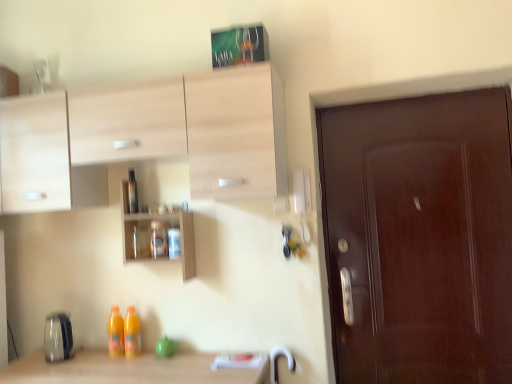
Question: From a real-world perspective, is wooden shelves at center physically located above or below transparent plastic bottle at center, the second bottle ordered from the bottom?

Choices:
 (A) above
 (B) below

Answer: (B)

Question: From the image's perspective, is wooden shelves at center located above or below transparent plastic bottle at center, the second bottle ordered from the bottom?

Choices:
 (A) below
 (B) above

Answer: (A)

Question: Estimate the real-world distances between objects in this image. Which object is closer to the wooden shelves at center?

Choices:
 (A) translucent glass jar at center, the first bottle in the right-to-left sequence
 (B) transparent plastic bottle at center, the second bottle ordered from the bottom

Answer: (A)

Question: Estimate the real-world distances between objects in this image. Which object is farther from the transparent plastic bottle at center, positioned as the 1th bottle in top-to-bottom order?

Choices:
 (A) translucent glass jar at center, the first bottle in the right-to-left sequence
 (B) wooden shelves at center

Answer: (A)